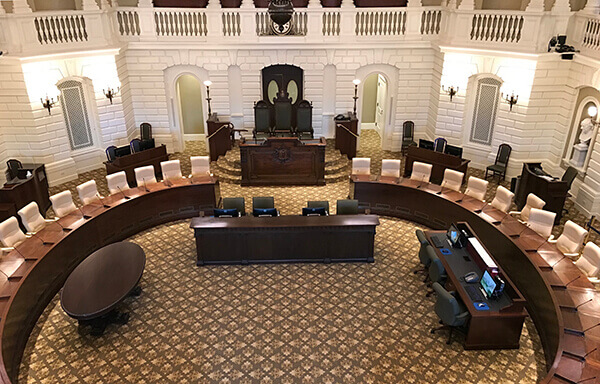
Identify the location of clock. (284, 28).